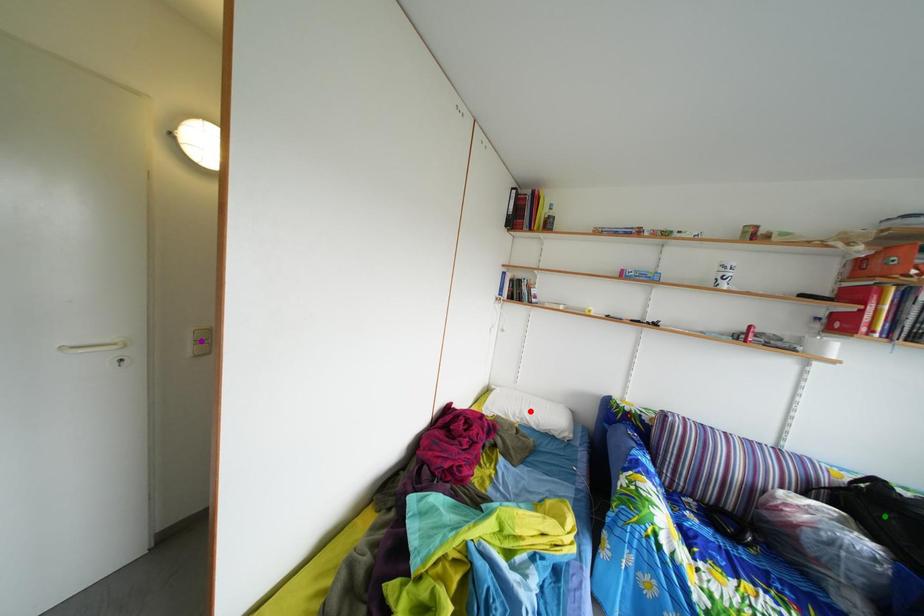
Order these from nearest to farthest:
1. green point
2. red point
3. purple point

green point
purple point
red point